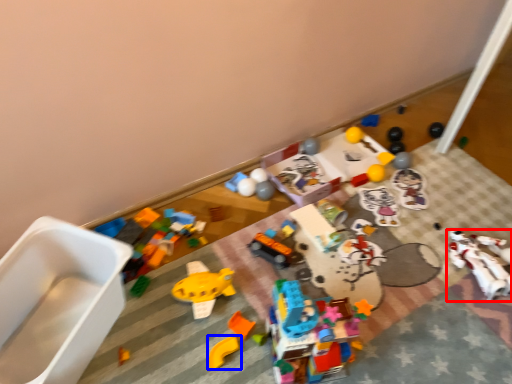
Question: Which object is closer to the camera taking this photo, toy (highlighted by a red box) or toy (highlighted by a blue box)?

Choices:
 (A) toy
 (B) toy

Answer: (B)